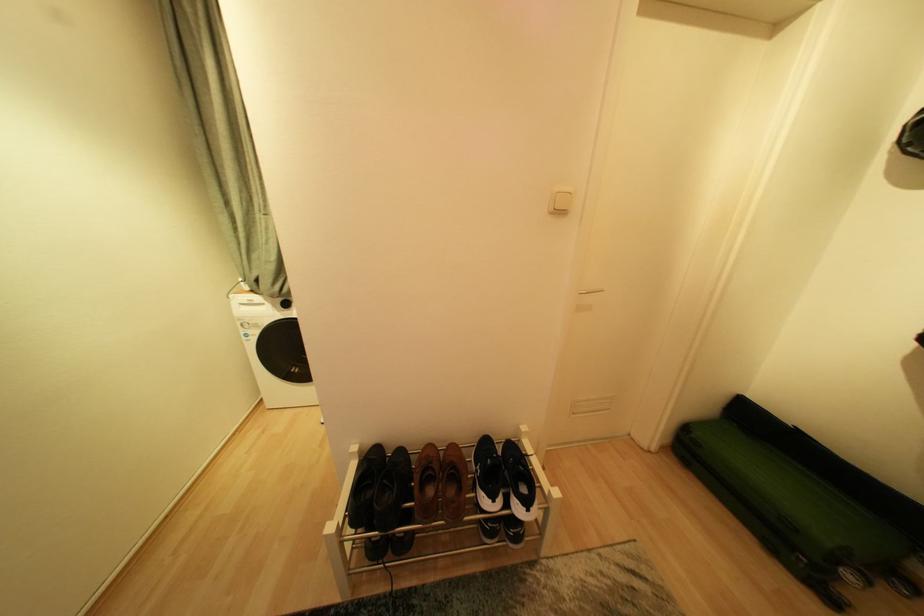
Image resolution: width=924 pixels, height=616 pixels. I want to click on washing machine door, so click(280, 347).